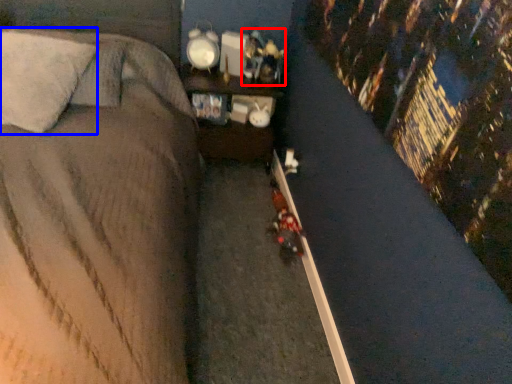
Question: Which object appears farthest to the camera in this image, toy (highlighted by a red box) or pillow (highlighted by a blue box)?

Choices:
 (A) toy
 (B) pillow

Answer: (A)